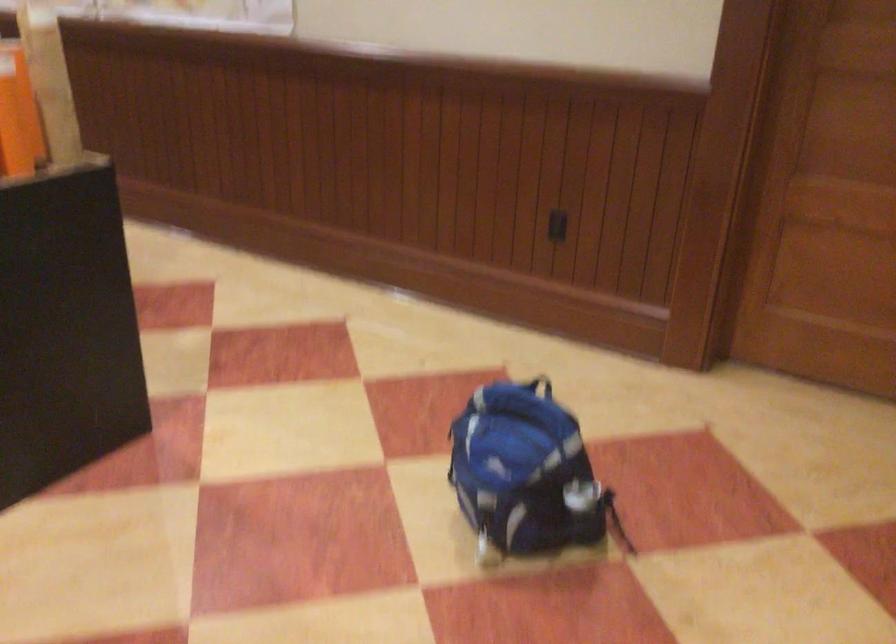
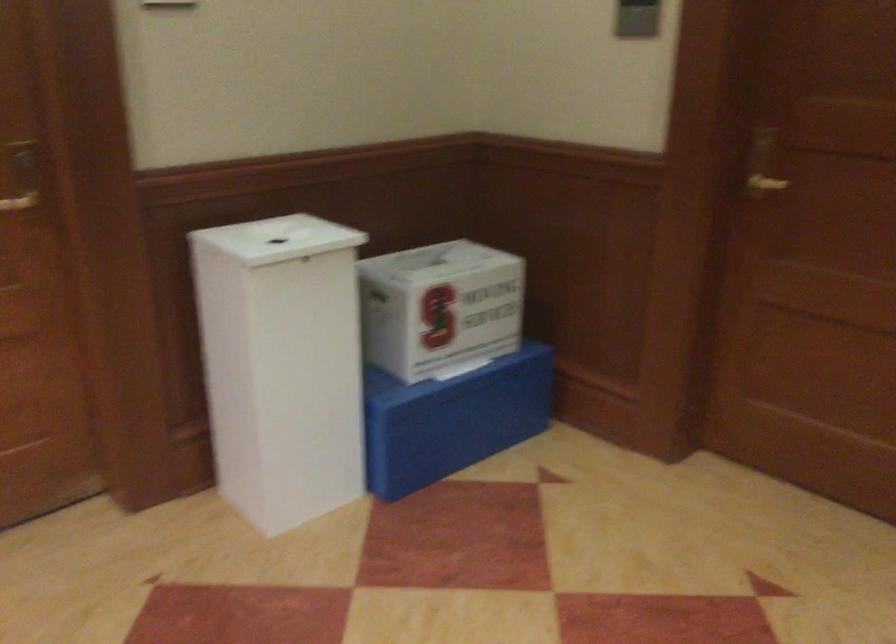
Question: Based on the continuous images, in which direction is the camera rotating? Reply with the corresponding letter.

Choices:
 (A) Left
 (B) Right
 (C) Up
 (D) Down

Answer: (B)